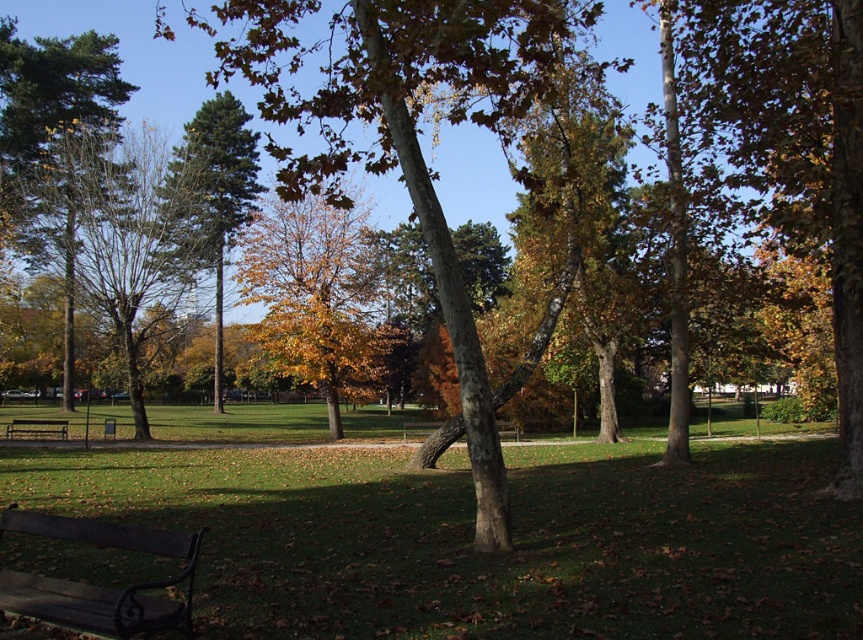
Question: Which point is closer to the camera taking this photo?

Choices:
 (A) (7, 518)
 (B) (325, 352)
 (C) (206, 508)

Answer: (A)

Question: Considering the real-world distances, which object is farthest from the black metal bench at lower left?

Choices:
 (A) wooden bench at center
 (B) wooden bench at lower left
 (C) yellow-green leaves at center
 (D) brown rough bark tree at center

Answer: (B)

Question: Is black metal bench at lower left smaller than green glossy tree at center?

Choices:
 (A) yes
 (B) no

Answer: (A)

Question: Does green grass at center have a larger size compared to yellow-green leaves at center?

Choices:
 (A) no
 (B) yes

Answer: (B)

Question: Observing the image, what is the correct spatial positioning of black metal bench at lower left in reference to wooden bench at lower left?

Choices:
 (A) below
 (B) above

Answer: (B)

Question: Which object is positioned farthest from the green glossy tree at center?

Choices:
 (A) wooden bench at center
 (B) yellow-green leaves at center
 (C) brown rough bark tree at center
 (D) wooden bench at lower left

Answer: (A)